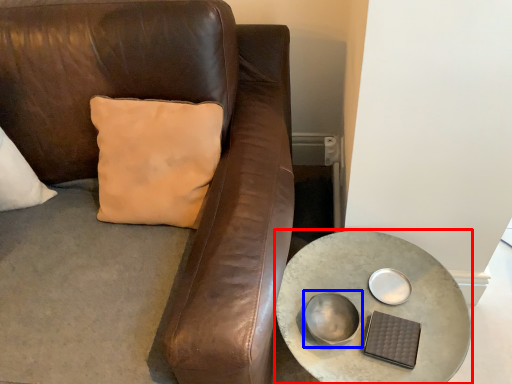
Question: Which object is further to the camera taking this photo, table (highlighted by a red box) or bowl (highlighted by a blue box)?

Choices:
 (A) table
 (B) bowl

Answer: (B)